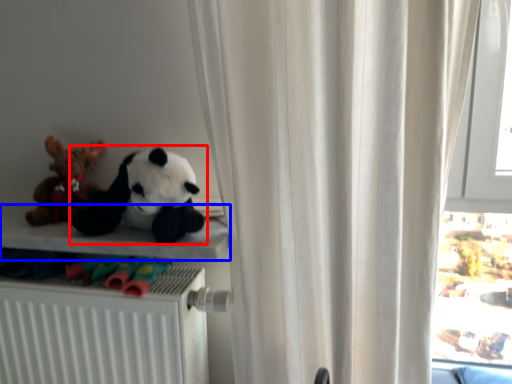
Question: Which of the following is the closest to the observer, toy (highlighted by a red box) or shelf (highlighted by a blue box)?

Choices:
 (A) toy
 (B) shelf

Answer: (A)